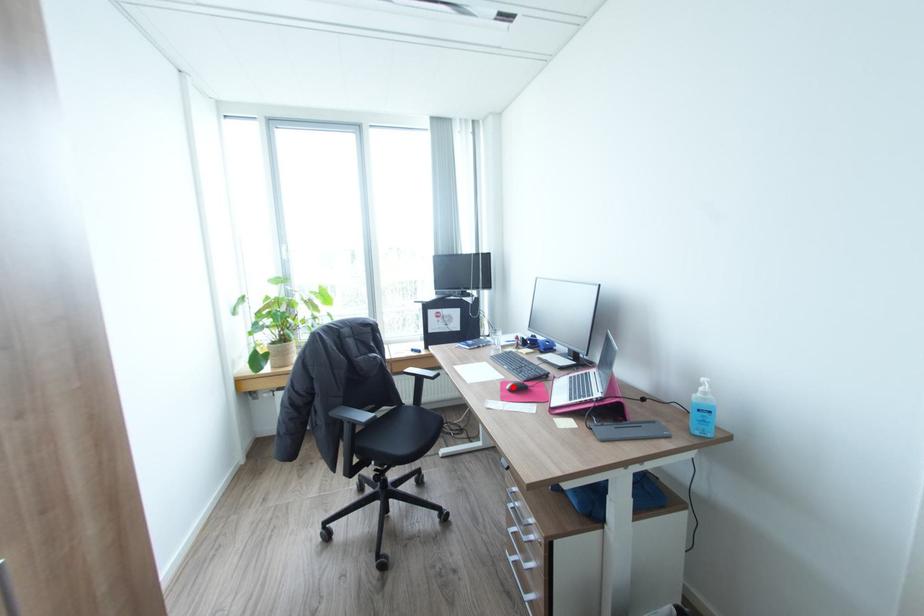
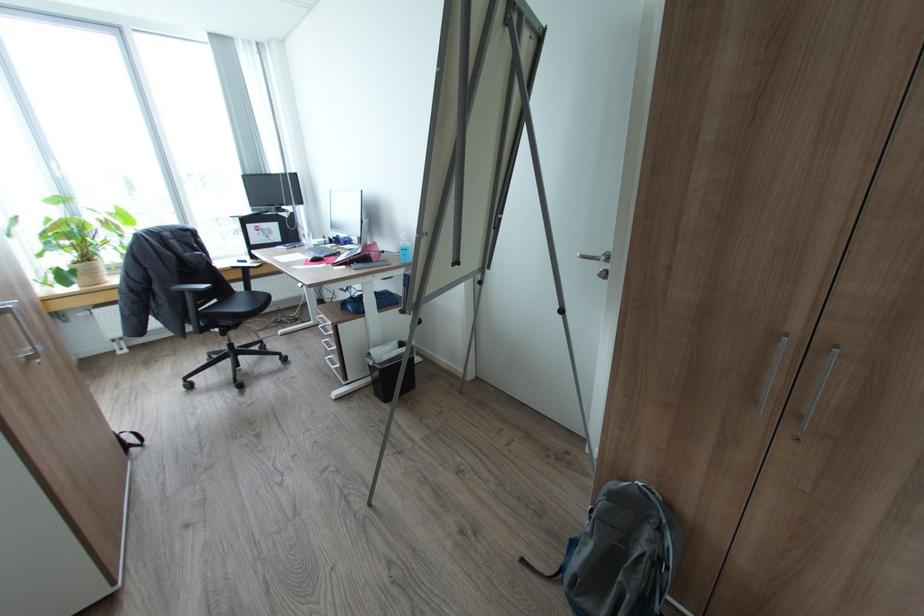
The point at the highlighted location is marked in the first image. Where is the corresponding point in the second image?

(314, 259)